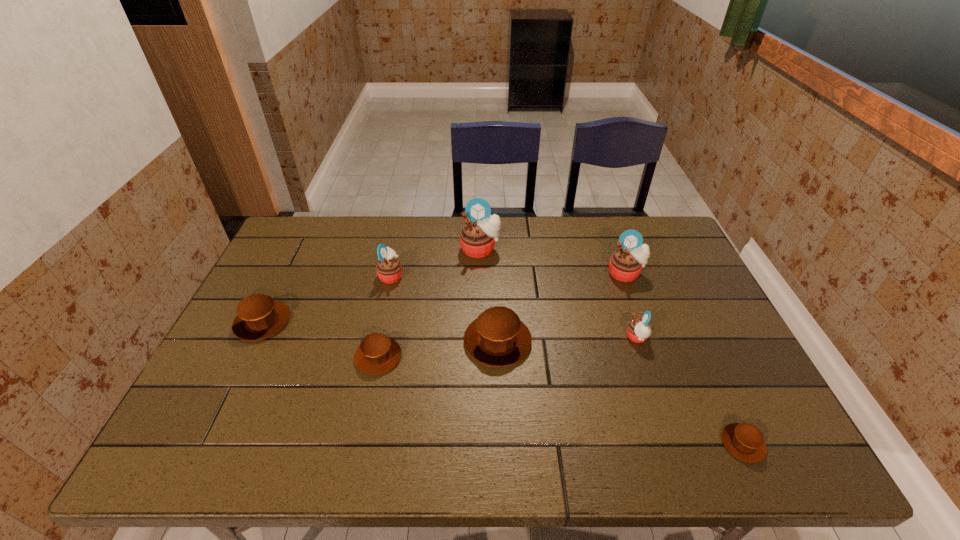
Locate an element on the screen. The image size is (960, 540). the farthest object is located at coordinates (481, 230).

This screenshot has height=540, width=960. Find the location of `the tallest object`. the tallest object is located at coordinates coord(481,230).

In order to click on the second tallest object in this screenshot , I will do `click(626, 263)`.

I want to click on the second tallest muffin, so [626, 263].

At what (x,y) coordinates should I click in order to perform the action: click on the leftmost pink muffin. Please return your answer as a coordinate pair (x, y). The height and width of the screenshot is (540, 960). Looking at the image, I should click on (389, 269).

The height and width of the screenshot is (540, 960). What are the coordinates of `the third brown muffin from left to right` in the screenshot? It's located at (497, 338).

Identify the location of the smallest pink muffin. (638, 330).

The image size is (960, 540). In order to click on the leftmost brown muffin in this screenshot , I will do `click(259, 316)`.

Where is `the leftmost object`? The image size is (960, 540). the leftmost object is located at coordinates (259, 316).

Locate an element on the screen. Image resolution: width=960 pixels, height=540 pixels. the seventh tallest muffin is located at coordinates (377, 353).